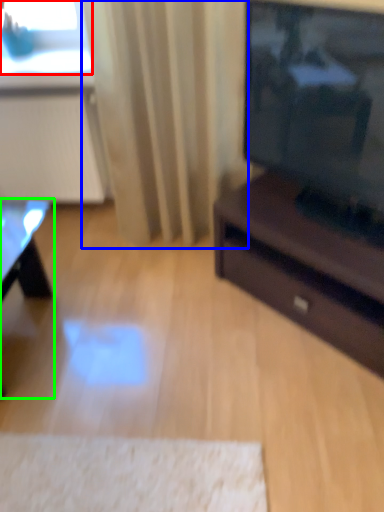
Question: Which object is positioned closest to window screen (highlighted by a red box)? Select from curtain (highlighted by a blue box) and table (highlighted by a green box).

Choices:
 (A) curtain
 (B) table

Answer: (A)